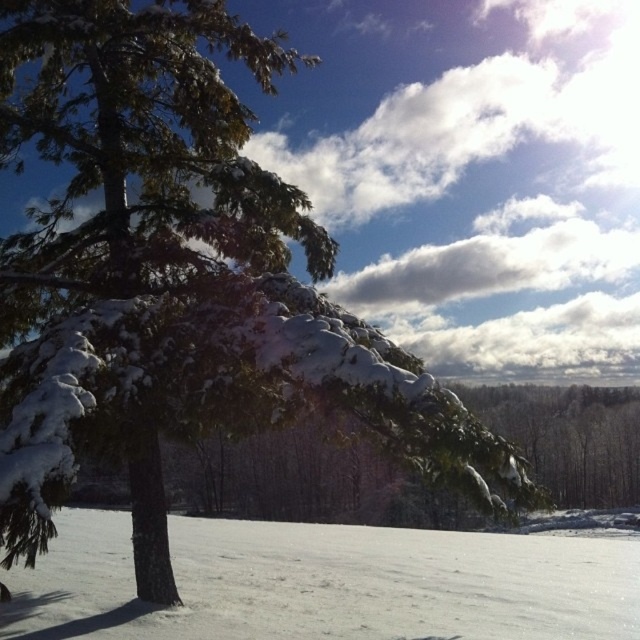
Question: Among these objects, which one is farthest from the camera?

Choices:
 (A) white snow at lower left
 (B) snow-covered evergreen tree at center

Answer: (A)

Question: Is white snow at lower left positioned behind snow-covered evergreen tree at center?

Choices:
 (A) no
 (B) yes

Answer: (B)

Question: Considering the relative positions of white snow at lower left and snow-covered evergreen tree at center in the image provided, where is white snow at lower left located with respect to snow-covered evergreen tree at center?

Choices:
 (A) right
 (B) left

Answer: (B)

Question: Is white snow at lower left thinner than snow-covered evergreen tree at center?

Choices:
 (A) yes
 (B) no

Answer: (B)

Question: Which object is closer to the camera taking this photo?

Choices:
 (A) snow-covered evergreen tree at center
 (B) white snow at lower left

Answer: (A)

Question: Among these points, which one is farthest from the camera?

Choices:
 (A) (605, 460)
 (B) (157, 636)

Answer: (A)